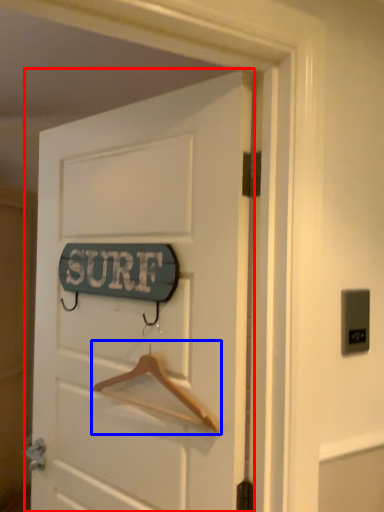
Question: Which of the following is the closest to the observer, door (highlighted by a red box) or hanger (highlighted by a blue box)?

Choices:
 (A) door
 (B) hanger

Answer: (A)